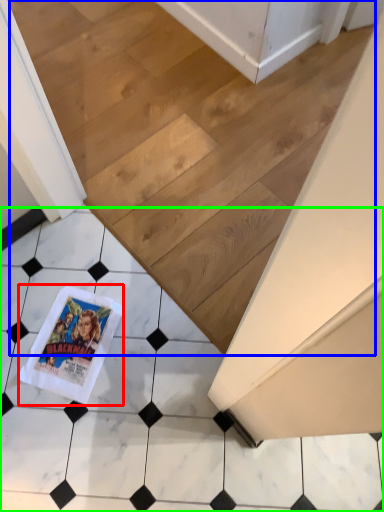
Question: Which is nearer to the comic book (highlighted by a red box)? stairwell (highlighted by a blue box) or tile (highlighted by a green box).

Choices:
 (A) stairwell
 (B) tile

Answer: (B)